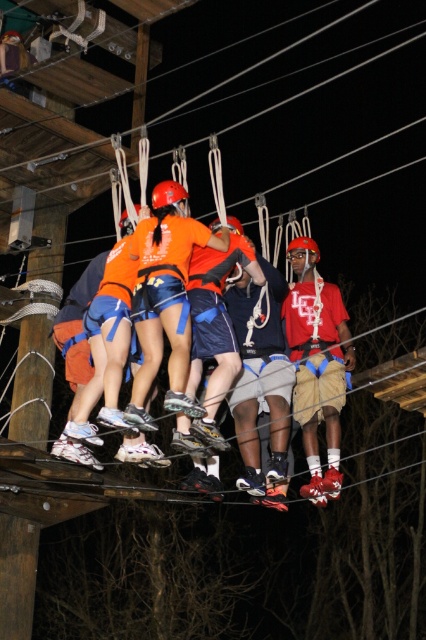
Question: Estimate the real-world distances between objects in this image. Which object is farther from the orange fabric shirt at center?

Choices:
 (A) orange fabric helmet at center
 (B) orange fabric shorts at center
 (C) red matte shirt at center

Answer: (C)

Question: Can you confirm if orange fabric shirt at center is positioned to the right of orange fabric shorts at center?

Choices:
 (A) no
 (B) yes

Answer: (B)

Question: Is orange fabric shirt at center to the right of red matte shirt at center from the viewer's perspective?

Choices:
 (A) yes
 (B) no

Answer: (B)

Question: Is red matte shirt at center thinner than orange fabric helmet at center?

Choices:
 (A) no
 (B) yes

Answer: (A)

Question: Which object is the farthest from the orange fabric shirt at center?

Choices:
 (A) orange fabric shorts at center
 (B) red matte shirt at center

Answer: (B)

Question: Which is nearer to the red matte shirt at center?

Choices:
 (A) orange fabric shorts at center
 (B) orange fabric shirt at center
 (C) orange fabric helmet at center

Answer: (C)